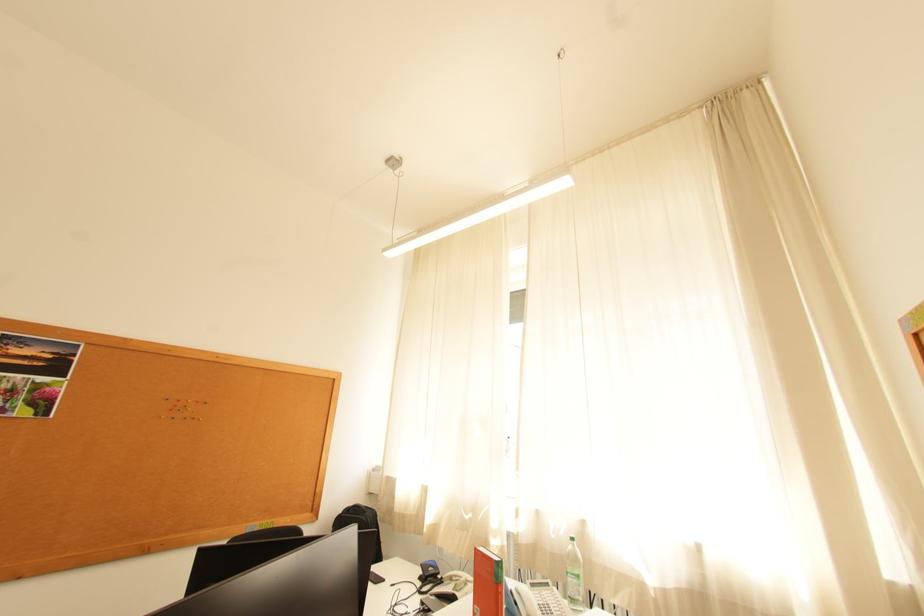
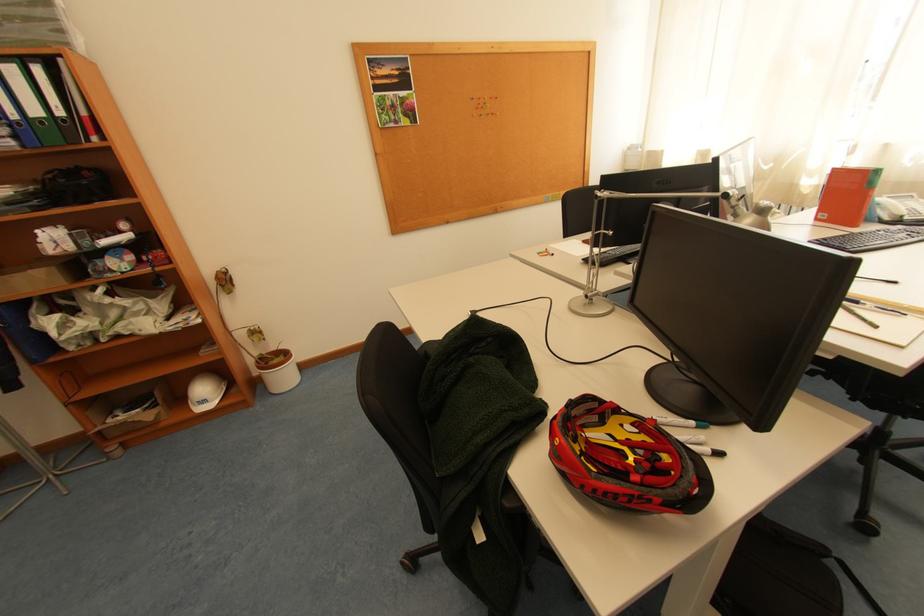
The point at (169, 419) is marked in the first image. Where is the corresponding point in the second image?

(481, 118)